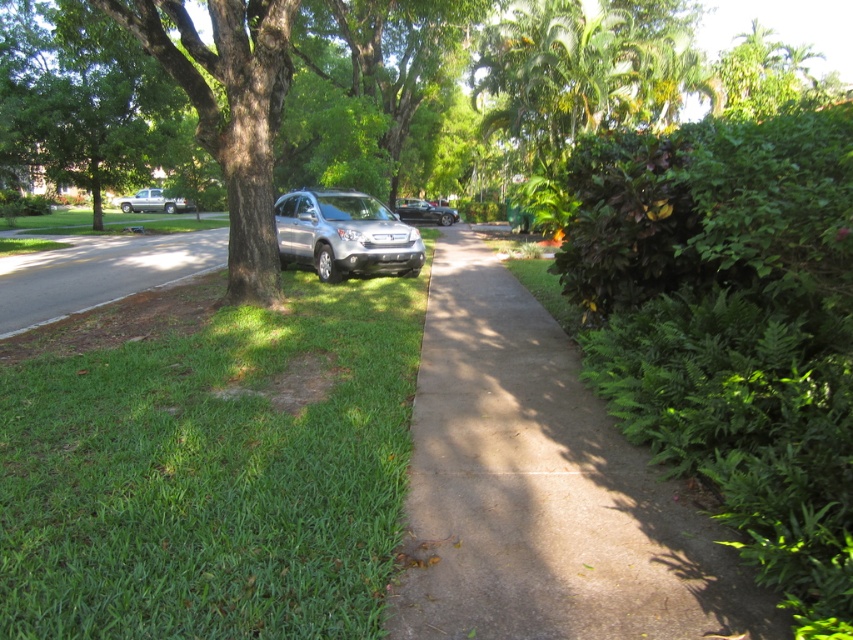
From the picture: Is satin silver suv at center bigger than satin black sedan at center?

Yes, satin silver suv at center is bigger than satin black sedan at center.

Which is more to the left, satin silver suv at center or satin black sedan at center?

Positioned to the left is satin silver suv at center.

Between point (308, 221) and point (404, 198), which one is positioned in front?

Positioned in front is point (308, 221).

Where is `satin silver suv at center`? satin silver suv at center is located at coordinates (344, 234).

Which is below, green leafy bush at right or silver metallic truck at left?

green leafy bush at right is below.

Is green leafy bush at right taller than silver metallic truck at left?

Correct, green leafy bush at right is much taller as silver metallic truck at left.

Image resolution: width=853 pixels, height=640 pixels. What do you see at coordinates (732, 326) in the screenshot? I see `green leafy bush at right` at bounding box center [732, 326].

The width and height of the screenshot is (853, 640). I want to click on green leafy bush at right, so click(x=732, y=326).

Which is more to the left, silver metallic truck at left or satin black sedan at center?

silver metallic truck at left is more to the left.

Is point (169, 200) behind point (426, 209)?

Yes.

Where is `silver metallic truck at left`? This screenshot has height=640, width=853. silver metallic truck at left is located at coordinates (152, 202).

At what (x,y) coordinates should I click in order to perform the action: click on silver metallic truck at left. Please return your answer as a coordinate pair (x, y). Looking at the image, I should click on (152, 202).